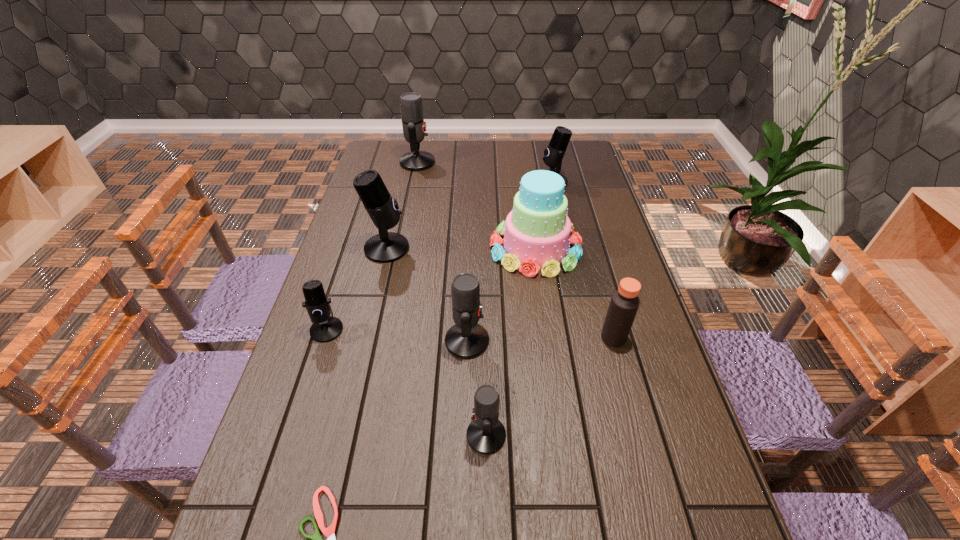
Find the location of `vacant region at the left edge of the desktop`. vacant region at the left edge of the desktop is located at coordinates [291, 404].

In the image, there is a desktop. Where is `vacant area at the right edge`? vacant area at the right edge is located at coordinates (659, 451).

Image resolution: width=960 pixels, height=540 pixels. In order to click on unoccupied area between the second smallest black microphone and the nearest red microphone in this screenshot , I will do click(x=519, y=308).

You are a GUI agent. You are given a task and a screenshot of the screen. Output one action in this format:
    pyautogui.click(x=<x>, y=<y>)
    Task: Click on the empty space between the leftmost red microphone and the biggest black microphone
    The height and width of the screenshot is (540, 960).
    Given the screenshot: What is the action you would take?
    pyautogui.click(x=402, y=205)

Locate an element on the screen. The width and height of the screenshot is (960, 540). empty location between the cake and the smallest red microphone is located at coordinates (511, 342).

You are a GUI agent. You are given a task and a screenshot of the screen. Output one action in this format:
    pyautogui.click(x=<x>, y=<y>)
    Task: Click on the empty space between the smallest black microphone and the smallest red microphone
    The height and width of the screenshot is (540, 960).
    Given the screenshot: What is the action you would take?
    pyautogui.click(x=406, y=383)

Find the location of a particular element. This screenshot has width=960, height=540. object that can be found as the fourth closest to the cake is located at coordinates point(385,247).

Identify the location of object that stands as the sixth closest to the nearest black microphone. (624, 303).

You are a GUI agent. You are given a task and a screenshot of the screen. Output one action in this format:
    pyautogui.click(x=<x>, y=<y>)
    Task: Click on the microphone that is the fourth closest to the green scissors
    The width and height of the screenshot is (960, 540).
    Given the screenshot: What is the action you would take?
    pyautogui.click(x=385, y=247)

At what (x,y) coordinates should I click in order to perform the action: click on the fifth closest microphone to the second farthest black microphone. Please return your answer as a coordinate pair (x, y). The width and height of the screenshot is (960, 540). Looking at the image, I should click on (486, 434).